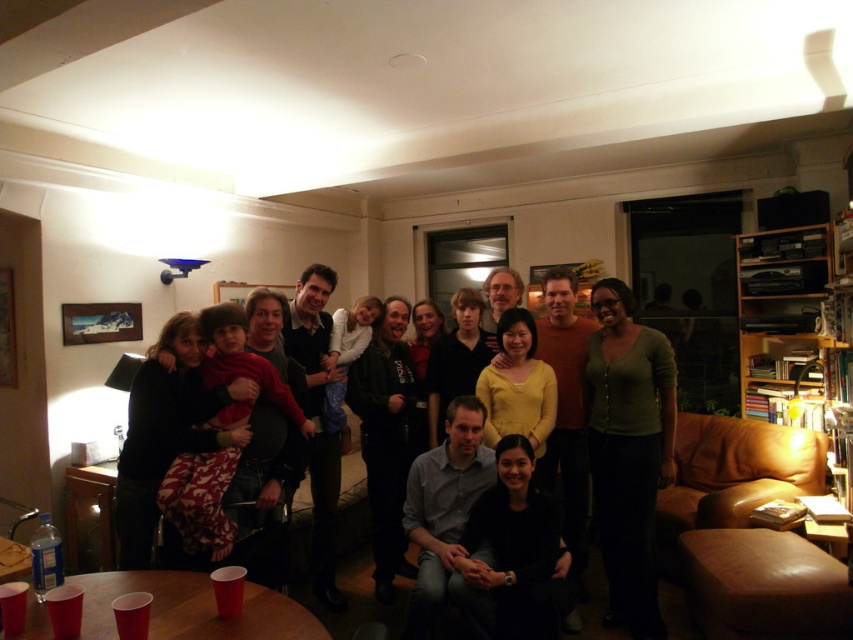
You are a photographer trying to adjust the lighting for a group photo. You notice two key elements in the frame, the dark brown hair at center and the matte black shirt at center. Which of these elements is located to the right of the other?

The dark brown hair at center is positioned on the right side of matte black shirt at center.

You are a photographer trying to adjust the lighting for a group photo. You notice the dark brown hair at center and the matte black shirt at center. Which object requires more light to ensure it is properly exposed?

The dark brown hair at center requires more light because its width is larger than the matte black shirt at center, making it need more exposure to appear balanced in the photo.